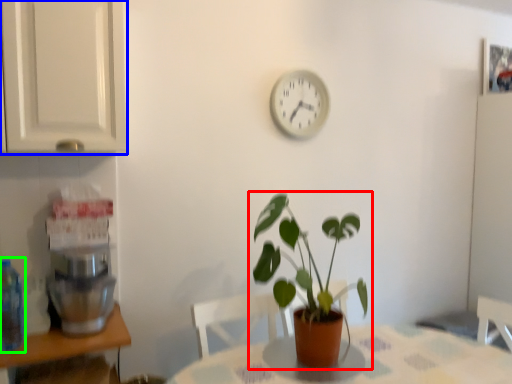
Question: Which object is the farthest from houseplant (highlighted by a red box)? Choose among these: cabinetry (highlighted by a blue box) or bottle (highlighted by a green box).

Choices:
 (A) cabinetry
 (B) bottle

Answer: (B)